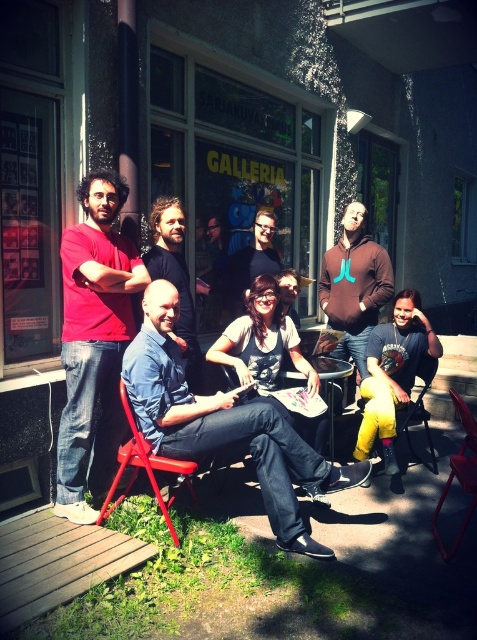
Question: Can you confirm if brown hoodie at center is wider than dark brown hair at center?

Choices:
 (A) no
 (B) yes

Answer: (B)

Question: Where is brown hoodie at center located in relation to metallic red chair at center in the image?

Choices:
 (A) left
 (B) right

Answer: (A)

Question: Estimate the real-world distances between objects in this image. Which object is closer to the metallic red folding chair at center?

Choices:
 (A) matte black shirt at center
 (B) matte red shirt at left
 (C) brown hoodie at center
 (D) denim shirt at center

Answer: (D)

Question: Where is yellow fabric chair at lower right located in relation to metallic red chair at center in the image?

Choices:
 (A) right
 (B) left

Answer: (B)

Question: Which is farther from the wooden deck at lower left?

Choices:
 (A) denim shirt at center
 (B) metallic red folding chair at center
 (C) dark brown hair at center
 (D) denim jeans at lower right

Answer: (C)

Question: Which object is the farthest from the wooden deck at lower left?

Choices:
 (A) denim jeans at lower right
 (B) dark brown hair at center
 (C) matte black shirt at center
 (D) matte red shirt at left

Answer: (C)